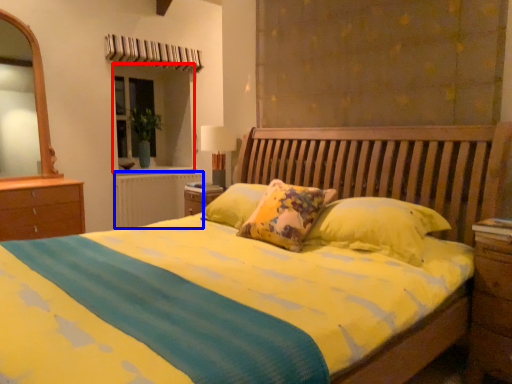
Question: Which point is further to the camera, window (highlighted by a red box) or radiator (highlighted by a blue box)?

Choices:
 (A) window
 (B) radiator

Answer: (A)